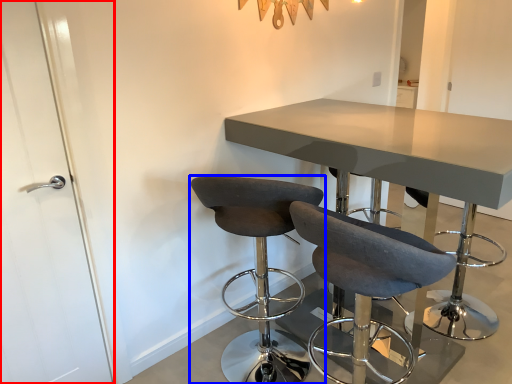
Question: Which object appears closest to the camera in this image, door (highlighted by a red box) or chair (highlighted by a blue box)?

Choices:
 (A) door
 (B) chair

Answer: (A)